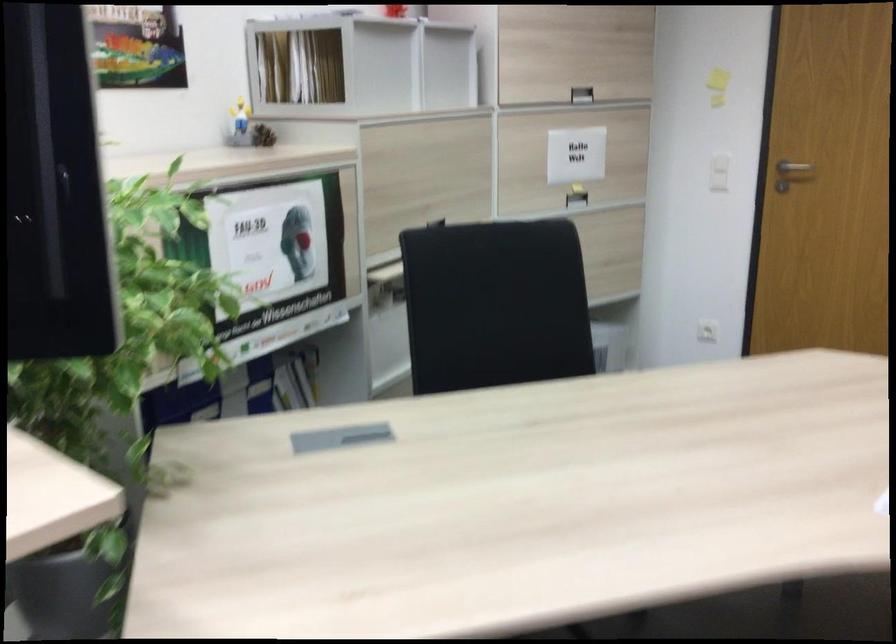
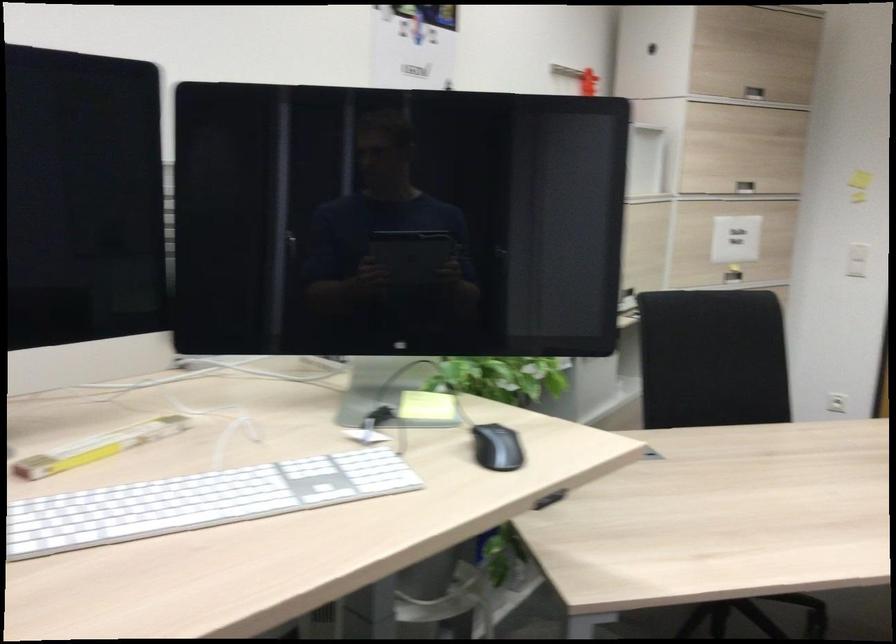
Where in the second image is the point corresponding to point 705,169 from the first image?

(857, 260)